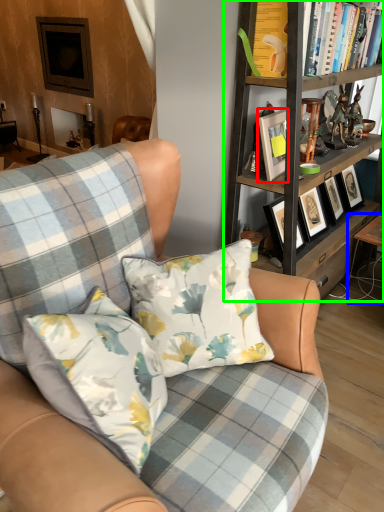
Question: Which object is positioned closest to picture frame (highlighted by a red box)? Select from table (highlighted by a blue box) and bookcase (highlighted by a green box).

Choices:
 (A) table
 (B) bookcase

Answer: (B)